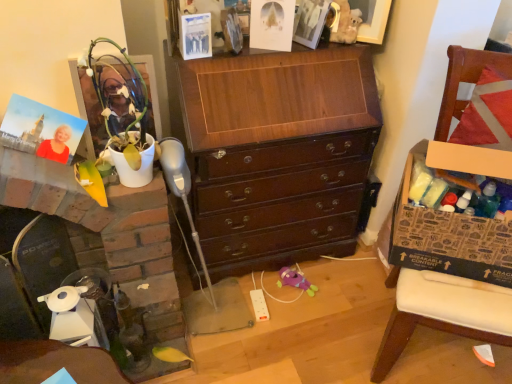
Question: Is white glossy fireplace at left spatially inside matte white picture frame at upper center, arranged as the 1th picture frame when viewed from the top, or outside of it?

Choices:
 (A) outside
 (B) inside

Answer: (A)

Question: Based on their sizes in the image, would you say white glossy fireplace at left is bigger or smaller than matte white picture frame at upper center, placed as the second picture frame when sorted from bottom to top?

Choices:
 (A) big
 (B) small

Answer: (A)

Question: Considering the real-world distances, which object is closest to the shiny dark wood chest of drawers at center?

Choices:
 (A) matte white picture frame at upper center, arranged as the 2th picture frame when viewed from the front
 (B) brown cardboard box at right
 (C) matte plastic picture frame at upper left, positioned as the 1th picture frame in bottom-to-top order
 (D) brown wooden chair at right
 (E) white glossy fireplace at left

Answer: (E)

Question: Which object is the closest to the shiny dark wood chest of drawers at center?

Choices:
 (A) brown cardboard box at right
 (B) white glossy fireplace at left
 (C) brown wooden chair at right
 (D) matte white picture frame at upper center, which is counted as the 1th picture frame, starting from the back
 (E) matte plastic picture frame at upper left, the second picture frame viewed from the top

Answer: (B)